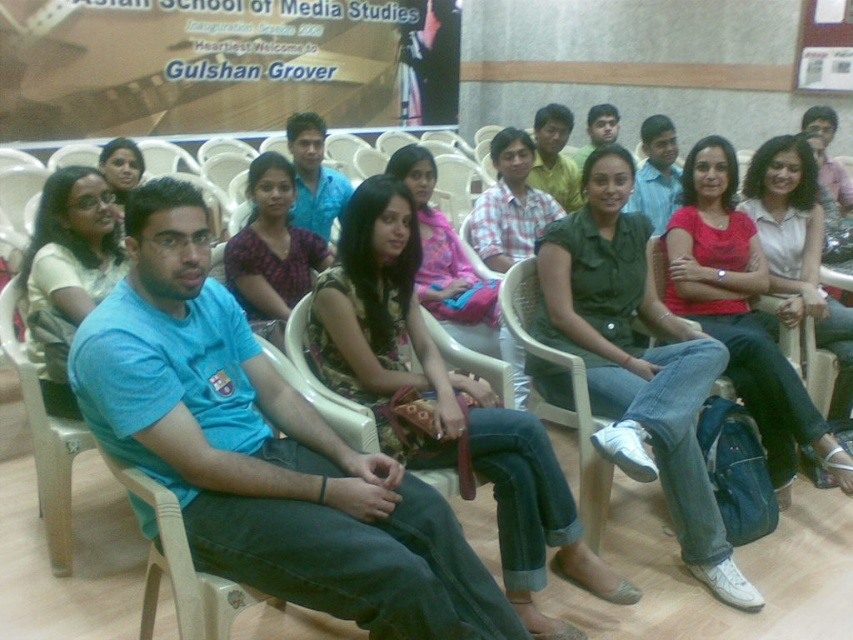
Question: Among these points, which one is farthest from the camera?

Choices:
 (A) (x=672, y=513)
 (B) (x=244, y=300)
 (C) (x=676, y=168)

Answer: (C)

Question: Considering the real-world distances, which object is closest to the matte pink shirt at center?

Choices:
 (A) blue t-shirt at left
 (B) floral fabric dress at center
 (C) matte green shirt at center
 (D) blue cotton t-shirt at center

Answer: (C)

Question: Does printed cotton shirt at center have a smaller size compared to matte green shirt at center?

Choices:
 (A) yes
 (B) no

Answer: (A)

Question: Is blue cotton t-shirt at center to the right of green cotton shirt at center from the viewer's perspective?

Choices:
 (A) no
 (B) yes

Answer: (A)

Question: Which of the following is the closest to the observer?

Choices:
 (A) floral fabric dress at center
 (B) green cotton shirt at center
 (C) blue t-shirt at left
 (D) matte pink shirt at center

Answer: (A)

Question: Does matte pink shirt at center appear on the left side of printed cotton shirt at center?

Choices:
 (A) yes
 (B) no

Answer: (B)